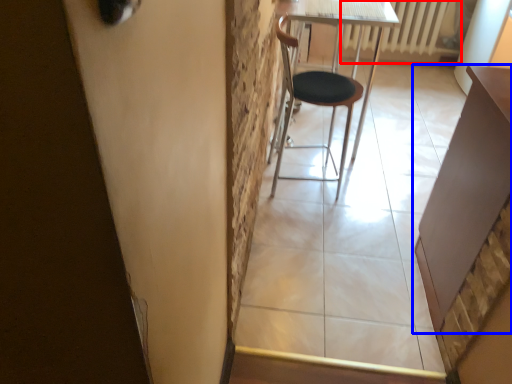
Question: Which of the following is the farthest to the observer, radiator (highlighted by a red box) or table (highlighted by a blue box)?

Choices:
 (A) radiator
 (B) table

Answer: (A)